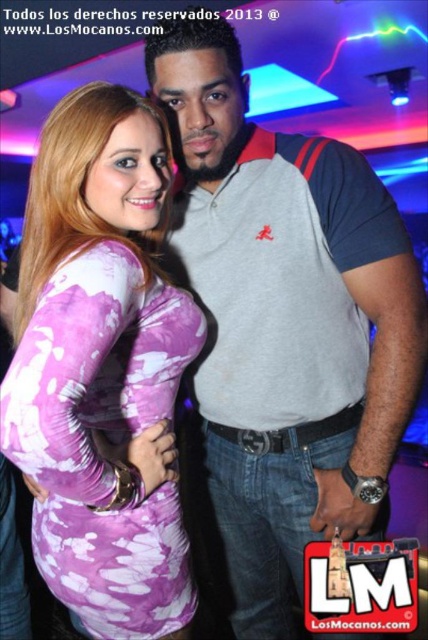
How distant is gray cotton polo shirt at center from purple tie-dye dress at center?

gray cotton polo shirt at center is 11.54 inches away from purple tie-dye dress at center.

Is gray cotton polo shirt at center bigger than purple tie-dye dress at center?

Indeed, gray cotton polo shirt at center has a larger size compared to purple tie-dye dress at center.

This screenshot has height=640, width=428. Describe the element at coordinates (285, 323) in the screenshot. I see `gray cotton polo shirt at center` at that location.

Locate an element on the screen. The width and height of the screenshot is (428, 640). gray cotton polo shirt at center is located at coordinates (285, 323).